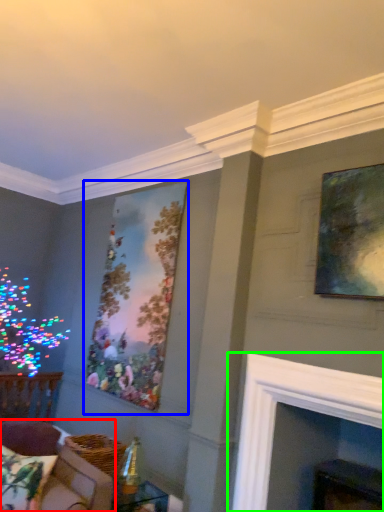
Question: Considering the real-world distances, which object is closest to couch (highlighted by a red box)? picture frame (highlighted by a blue box) or fireplace (highlighted by a green box).

Choices:
 (A) picture frame
 (B) fireplace

Answer: (B)